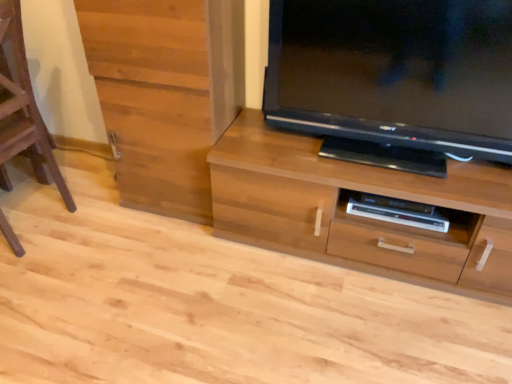
Question: From a real-world perspective, is wooden cabinet at left under brown wooden stool at left?

Choices:
 (A) no
 (B) yes

Answer: (A)

Question: Does wooden cabinet at left have a greater width compared to brown wooden stool at left?

Choices:
 (A) yes
 (B) no

Answer: (B)

Question: From the image's perspective, is wooden cabinet at left on brown wooden stool at left?

Choices:
 (A) no
 (B) yes

Answer: (B)

Question: Does wooden cabinet at left appear on the right side of brown wooden stool at left?

Choices:
 (A) no
 (B) yes

Answer: (B)

Question: Is wooden cabinet at left thinner than brown wooden stool at left?

Choices:
 (A) no
 (B) yes

Answer: (B)

Question: Is wooden cabinet at left at the left side of brown wooden stool at left?

Choices:
 (A) yes
 (B) no

Answer: (B)

Question: Is brown wooden stool at left far away from black glossy television at upper right?

Choices:
 (A) yes
 (B) no

Answer: (A)

Question: Does brown wooden stool at left lie behind black glossy television at upper right?

Choices:
 (A) no
 (B) yes

Answer: (B)

Question: Can you confirm if brown wooden stool at left is positioned to the left of black glossy television at upper right?

Choices:
 (A) no
 (B) yes

Answer: (B)

Question: From a real-world perspective, is brown wooden stool at left located higher than black glossy television at upper right?

Choices:
 (A) no
 (B) yes

Answer: (A)

Question: Can you confirm if brown wooden stool at left is bigger than black glossy television at upper right?

Choices:
 (A) yes
 (B) no

Answer: (A)

Question: Is brown wooden stool at left taller than black glossy television at upper right?

Choices:
 (A) yes
 (B) no

Answer: (A)

Question: Is wooden cabinet at left not inside wooden chest of drawers at center?

Choices:
 (A) yes
 (B) no

Answer: (A)